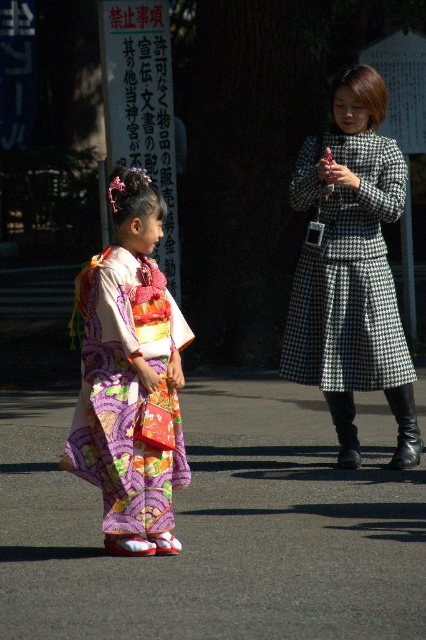
How far apart are houndstooth wool coat at center and multicolored silk kimono at left?

houndstooth wool coat at center is 1.75 meters from multicolored silk kimono at left.

Is point (307, 339) closer to camera compared to point (111, 477)?

No.

I want to click on houndstooth wool coat at center, so click(x=348, y=272).